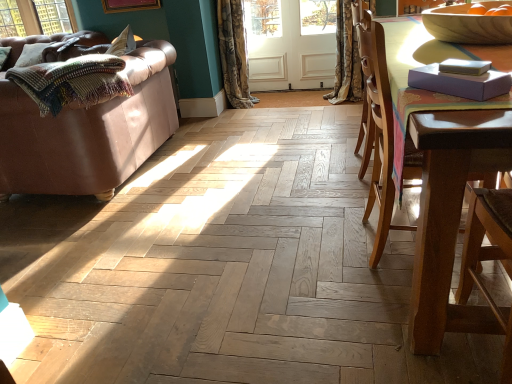
Question: Is point (472, 246) positioned closer to the camera than point (338, 4)?

Choices:
 (A) farther
 (B) closer

Answer: (B)

Question: From their relative heights in the image, would you say matte purple armchair at right is taller or shorter than floral fabric curtain at upper right, which is the 1th curtain in right-to-left order?

Choices:
 (A) short
 (B) tall

Answer: (B)

Question: Estimate the real-world distances between objects in this image. Which object is farther from the leather couch at left?

Choices:
 (A) purple matte book at upper right
 (B) brown wooden chair at right
 (C) matte purple armchair at right
 (D) wooden bowl at upper right
 (E) white wood screen door at center

Answer: (C)

Question: Estimate the real-world distances between objects in this image. Which object is farther from the floral fabric curtain at upper right, which is the second curtain from left to right?

Choices:
 (A) wooden bowl at upper right
 (B) textured floral curtain at center, arranged as the 1th curtain when viewed from the left
 (C) purple matte book at upper right
 (D) brown wooden chair at right
 (E) white wood screen door at center

Answer: (C)